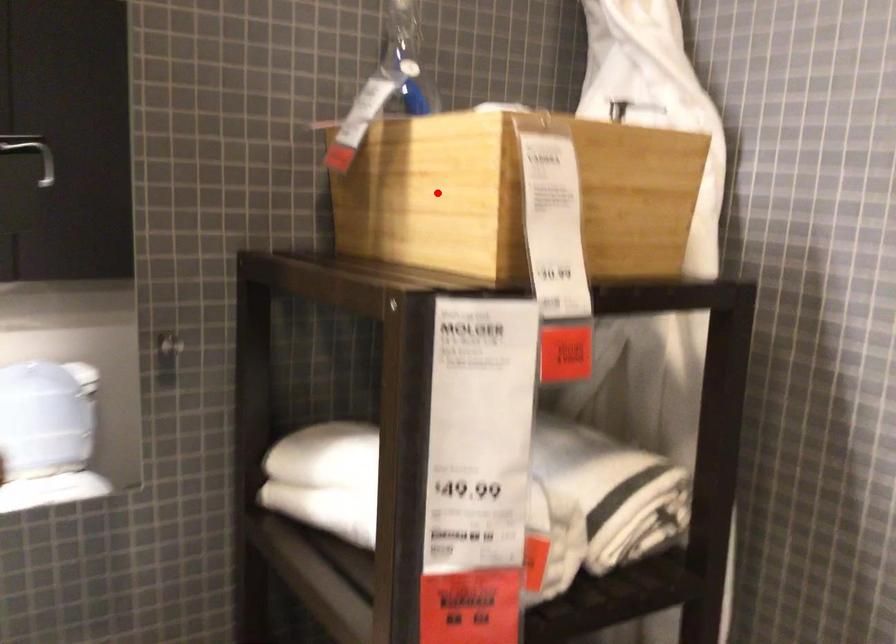
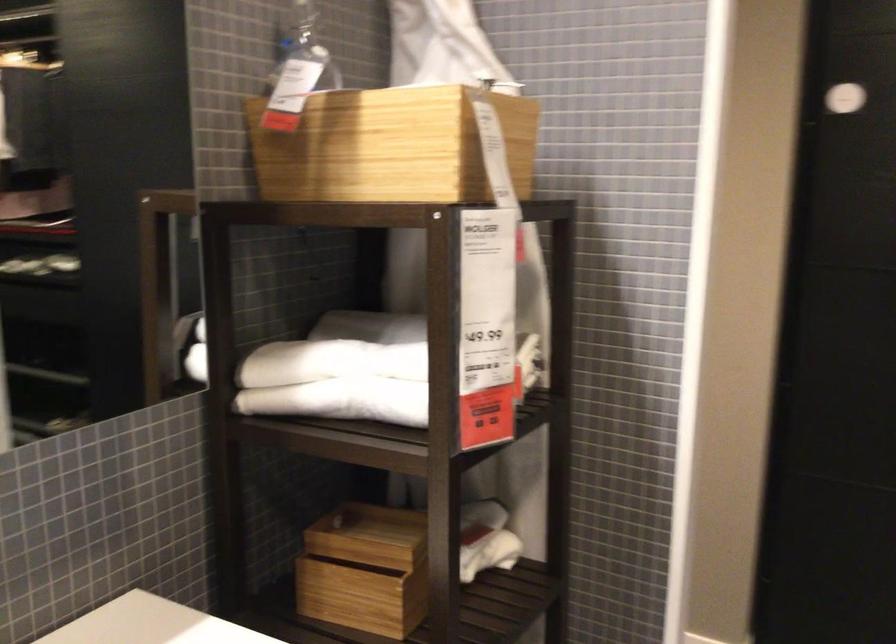
The point at the highlighted location is marked in the first image. Where is the corresponding point in the second image?

(390, 147)